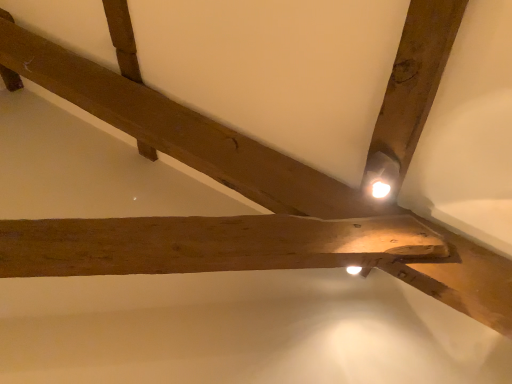
The height and width of the screenshot is (384, 512). Describe the element at coordinates (381, 178) in the screenshot. I see `white glossy light fixture at upper right` at that location.

Locate an element on the screen. Image resolution: width=512 pixels, height=384 pixels. white glossy light fixture at upper right is located at coordinates (381, 178).

Locate an element on the screen. The image size is (512, 384). white glossy light fixture at upper right is located at coordinates (381, 178).